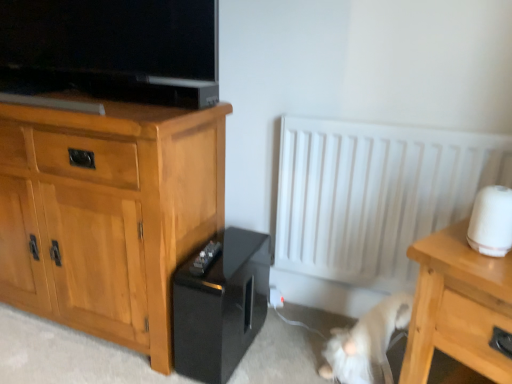
Question: Does black glossy amplifier at lower center have a larger size compared to light wood cabinet at left?

Choices:
 (A) no
 (B) yes

Answer: (A)

Question: From the image's perspective, is black glossy amplifier at lower center located above light wood cabinet at left?

Choices:
 (A) yes
 (B) no

Answer: (B)

Question: Can you confirm if black glossy amplifier at lower center is shorter than light wood cabinet at left?

Choices:
 (A) no
 (B) yes

Answer: (B)

Question: Is black glossy amplifier at lower center outside light wood cabinet at left?

Choices:
 (A) yes
 (B) no

Answer: (A)

Question: Is light wood cabinet at left completely or partially inside black glossy amplifier at lower center?

Choices:
 (A) no
 (B) yes

Answer: (A)

Question: Is black glossy amplifier at lower center at the right side of light wood cabinet at left?

Choices:
 (A) yes
 (B) no

Answer: (A)

Question: Is light wood cabinet at left outside of black glossy amplifier at lower center?

Choices:
 (A) no
 (B) yes

Answer: (B)

Question: From a real-world perspective, is light wood cabinet at left below black glossy amplifier at lower center?

Choices:
 (A) no
 (B) yes

Answer: (A)

Question: Can you confirm if light wood cabinet at left is bigger than black glossy amplifier at lower center?

Choices:
 (A) no
 (B) yes

Answer: (B)

Question: Is light wood cabinet at left facing away from black glossy amplifier at lower center?

Choices:
 (A) yes
 (B) no

Answer: (B)

Question: Is light wood cabinet at left surrounding black glossy amplifier at lower center?

Choices:
 (A) yes
 (B) no

Answer: (B)

Question: Are light wood cabinet at left and black glossy amplifier at lower center far apart?

Choices:
 (A) yes
 (B) no

Answer: (B)

Question: From the image's perspective, is light wood cabinet at left under white fur cat at lower right?

Choices:
 (A) yes
 (B) no

Answer: (B)